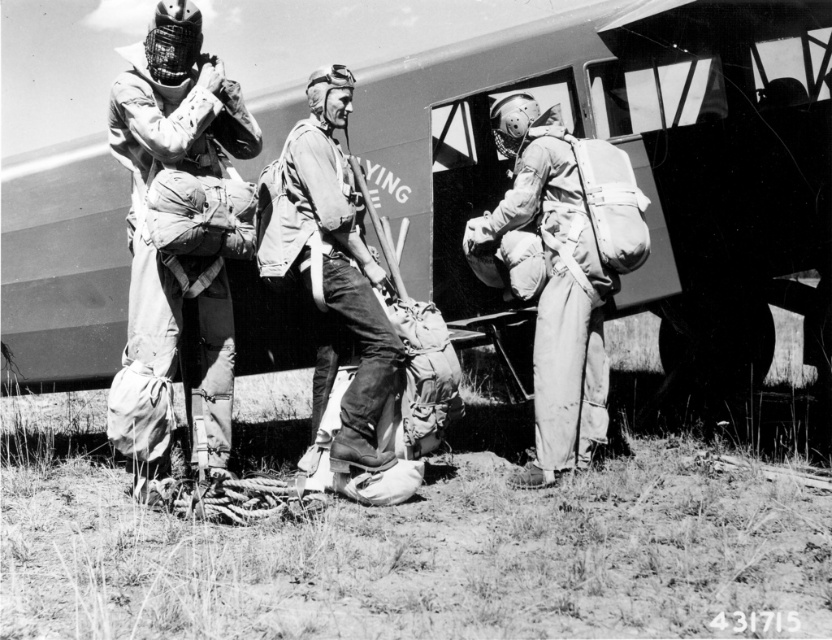
Measure the distance between matte khaki jumpsuit at center and camera.

matte khaki jumpsuit at center is 4.13 meters from camera.

Does matte khaki jumpsuit at center appear on the left side of matte khaki uniform at center?

In fact, matte khaki jumpsuit at center is to the right of matte khaki uniform at center.

Is point (563, 148) positioned behind point (394, 372)?

Yes, it is.

Image resolution: width=832 pixels, height=640 pixels. What are the coordinates of `matte khaki jumpsuit at center` in the screenshot? It's located at (553, 285).

Which is behind, point (730, 310) or point (164, 45)?

Positioned behind is point (730, 310).

Between metallic fuselage at center and matte khaki jumpsuit at left, which one is positioned higher?

Positioned higher is metallic fuselage at center.

Does point (729, 266) come behind point (139, 337)?

That is True.

The image size is (832, 640). What are the coordinates of `metallic fuselage at center` in the screenshot? It's located at pos(635,172).

Who is positioned more to the right, matte khaki jumpsuit at left or matte khaki jumpsuit at center?

From the viewer's perspective, matte khaki jumpsuit at center appears more on the right side.

Can you confirm if matte khaki jumpsuit at left is positioned above matte khaki jumpsuit at center?

Indeed, matte khaki jumpsuit at left is positioned over matte khaki jumpsuit at center.

Which is behind, point (162, 49) or point (555, 124)?

Point (555, 124)

Find the location of a particular element. The width and height of the screenshot is (832, 640). matte khaki jumpsuit at left is located at coordinates (179, 237).